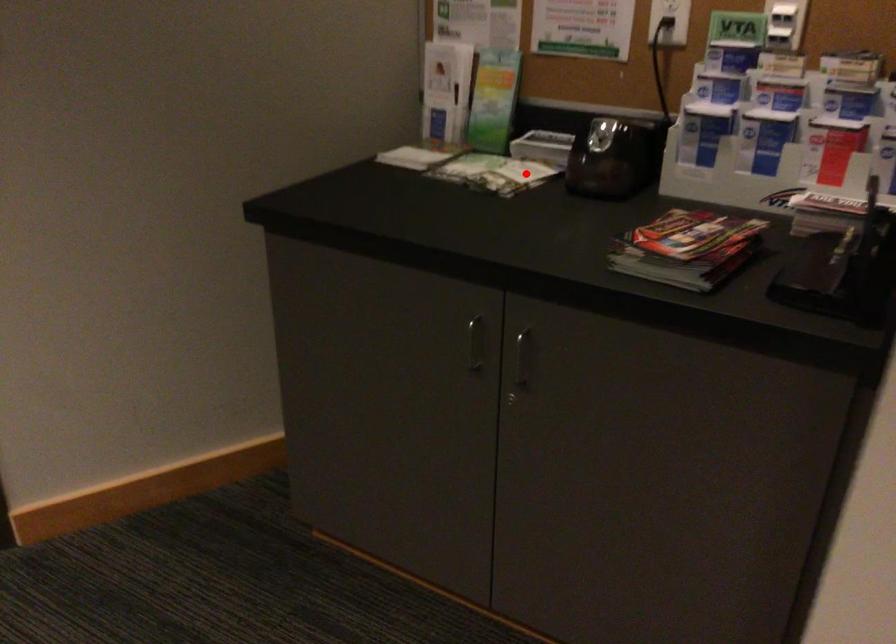
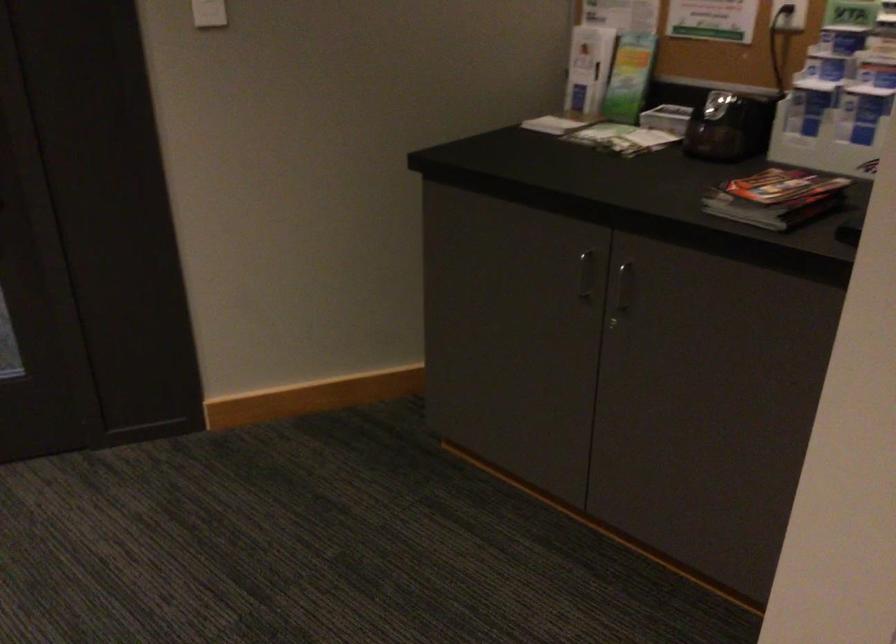
Question: A red point is marked in image1. In image2, is the corresponding 3D point closer to the camera or farther? Reply with the corresponding letter.

Choices:
 (A) The corresponding 3D point is closer.
 (B) The corresponding 3D point is farther.

Answer: (B)